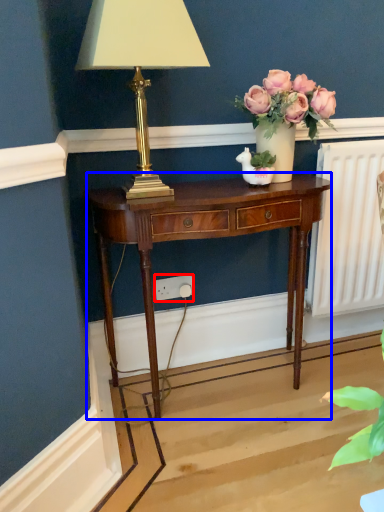
Question: Among these objects, which one is nearest to the camera, power outlet (highlighted by a red box) or nightstand (highlighted by a blue box)?

Choices:
 (A) power outlet
 (B) nightstand

Answer: (B)